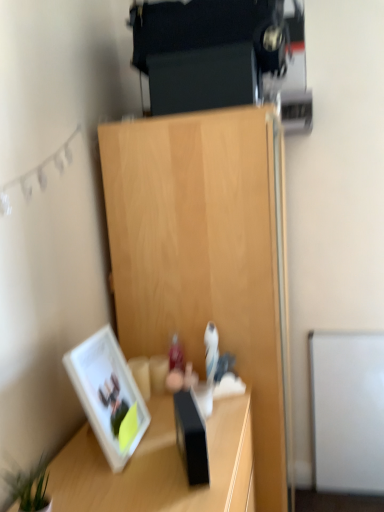
Locate an element on the screen. light wood cabinet at center is located at coordinates (207, 257).

Locate an element on the screen. green leafy plant at lower left is located at coordinates (29, 487).

The image size is (384, 512). Describe the element at coordinates (160, 467) in the screenshot. I see `wooden desk at lower left` at that location.

What are the coordinates of `white glossy picture frame at lower left` in the screenshot? It's located at (107, 393).

Locate an element on the screen. The width and height of the screenshot is (384, 512). light wood cabinet at center is located at coordinates (207, 257).

Between point (24, 495) and point (117, 434), which one is positioned behind?

Point (117, 434)

From the picture: Considering the relative sizes of green leafy plant at lower left and white glossy picture frame at lower left in the image provided, is green leafy plant at lower left wider than white glossy picture frame at lower left?

Incorrect, the width of green leafy plant at lower left does not surpass that of white glossy picture frame at lower left.

Is green leafy plant at lower left oriented towards white glossy picture frame at lower left?

No, green leafy plant at lower left is not aimed at white glossy picture frame at lower left.

Is light wood cabinet at center facing towards white glossy picture frame at lower left?

No.

Who is smaller, light wood cabinet at center or white glossy picture frame at lower left?

Smaller between the two is white glossy picture frame at lower left.

Who is shorter, light wood cabinet at center or white glossy picture frame at lower left?

white glossy picture frame at lower left is shorter.

How many degrees apart are the facing directions of light wood cabinet at center and white glossy picture frame at lower left?

4.17 degrees separate the facing orientations of light wood cabinet at center and white glossy picture frame at lower left.

Between wooden desk at lower left and light wood cabinet at center, which one has smaller size?

wooden desk at lower left is smaller.

Is wooden desk at lower left not within light wood cabinet at center?

Yes, wooden desk at lower left is not within light wood cabinet at center.

Considering the positions of objects wooden desk at lower left and light wood cabinet at center in the image provided, who is more to the right, wooden desk at lower left or light wood cabinet at center?

Positioned to the right is light wood cabinet at center.

Is white glossy picture frame at lower left smaller than light wood cabinet at center?

Yes.

Identify the location of picture frame above the light wood cabinet at center (from a real-world perspective). (107, 393).

Is point (75, 386) positioned behind point (240, 170)?

No, (75, 386) is in front of (240, 170).

Does green leafy plant at lower left contain wooden desk at lower left?

No, green leafy plant at lower left does not contain wooden desk at lower left.

Does green leafy plant at lower left appear on the left side of wooden desk at lower left?

Indeed, green leafy plant at lower left is positioned on the left side of wooden desk at lower left.

Is green leafy plant at lower left not near wooden desk at lower left?

No, green leafy plant at lower left is in close proximity to wooden desk at lower left.

Considering the relative sizes of green leafy plant at lower left and wooden desk at lower left in the image provided, is green leafy plant at lower left smaller than wooden desk at lower left?

Correct, green leafy plant at lower left occupies less space than wooden desk at lower left.

The height and width of the screenshot is (512, 384). I want to click on desk below the green leafy plant at lower left (from a real-world perspective), so click(160, 467).

How distant is wooden desk at lower left from green leafy plant at lower left?

wooden desk at lower left is 10.31 inches away from green leafy plant at lower left.

From a real-world perspective, is wooden desk at lower left positioned above or below green leafy plant at lower left?

wooden desk at lower left is situated lower than green leafy plant at lower left in the real world.

Is wooden desk at lower left next to green leafy plant at lower left and touching it?

No, wooden desk at lower left is not making contact with green leafy plant at lower left.

Is light wood cabinet at center far from wooden desk at lower left?

No, light wood cabinet at center is not far away from wooden desk at lower left.

Is light wood cabinet at center positioned beyond the bounds of wooden desk at lower left?

light wood cabinet at center is positioned outside wooden desk at lower left.

Does light wood cabinet at center turn towards wooden desk at lower left?

No, light wood cabinet at center does not turn towards wooden desk at lower left.

Where is `cabinetry above the wooden desk at lower left (from a real-world perspective)`? The width and height of the screenshot is (384, 512). cabinetry above the wooden desk at lower left (from a real-world perspective) is located at coordinates (207, 257).

Identify the location of picture frame that is behind the green leafy plant at lower left. The image size is (384, 512). (107, 393).

Where is `picture frame located above the light wood cabinet at center (from the image's perspective)`? picture frame located above the light wood cabinet at center (from the image's perspective) is located at coordinates (107, 393).

Considering their positions, is light wood cabinet at center positioned closer to green leafy plant at lower left than white glossy picture frame at lower left?

The object closer to green leafy plant at lower left is white glossy picture frame at lower left.

Which object lies further to the anchor point white glossy picture frame at lower left, light wood cabinet at center or green leafy plant at lower left?

Among the two, light wood cabinet at center is located further to white glossy picture frame at lower left.

Which object lies nearer to the anchor point green leafy plant at lower left, wooden desk at lower left or white glossy picture frame at lower left?

white glossy picture frame at lower left is positioned closer to the anchor green leafy plant at lower left.

Estimate the real-world distances between objects in this image. Which object is closer to green leafy plant at lower left, white glossy picture frame at lower left or wooden desk at lower left?

white glossy picture frame at lower left lies closer to green leafy plant at lower left than the other object.

From the image, which object appears to be nearer to green leafy plant at lower left, wooden desk at lower left or light wood cabinet at center?

Based on the image, wooden desk at lower left appears to be nearer to green leafy plant at lower left.

Based on the photo, based on their spatial positions, is wooden desk at lower left or light wood cabinet at center closer to white glossy picture frame at lower left?

Based on the image, wooden desk at lower left appears to be nearer to white glossy picture frame at lower left.

Looking at the image, which one is located closer to light wood cabinet at center, green leafy plant at lower left or wooden desk at lower left?

wooden desk at lower left.

Which object lies further to the anchor point light wood cabinet at center, white glossy picture frame at lower left or wooden desk at lower left?

Based on the image, white glossy picture frame at lower left appears to be further to light wood cabinet at center.

At what (x,y) coordinates should I click in order to perform the action: click on plant between white glossy picture frame at lower left and wooden desk at lower left in the vertical direction. Please return your answer as a coordinate pair (x, y). Looking at the image, I should click on (29, 487).

Identify the location of picture frame positioned between green leafy plant at lower left and light wood cabinet at center from near to far. (107, 393).

Identify the location of desk between green leafy plant at lower left and light wood cabinet at center from front to back. [160, 467].

This screenshot has height=512, width=384. I want to click on picture frame between wooden desk at lower left and light wood cabinet at center along the z-axis, so [x=107, y=393].